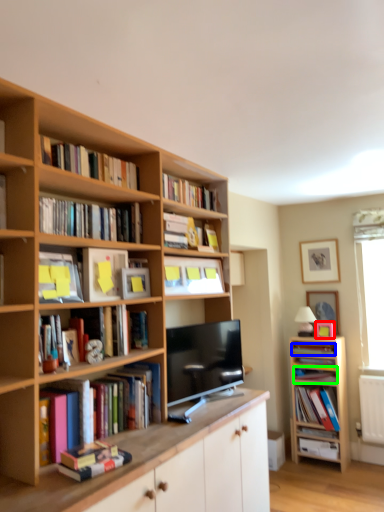
Question: Which object is the farthest from picture frame (highlighted by a red box)? Choose among these: book (highlighted by a blue box) or book (highlighted by a green box).

Choices:
 (A) book
 (B) book

Answer: (B)